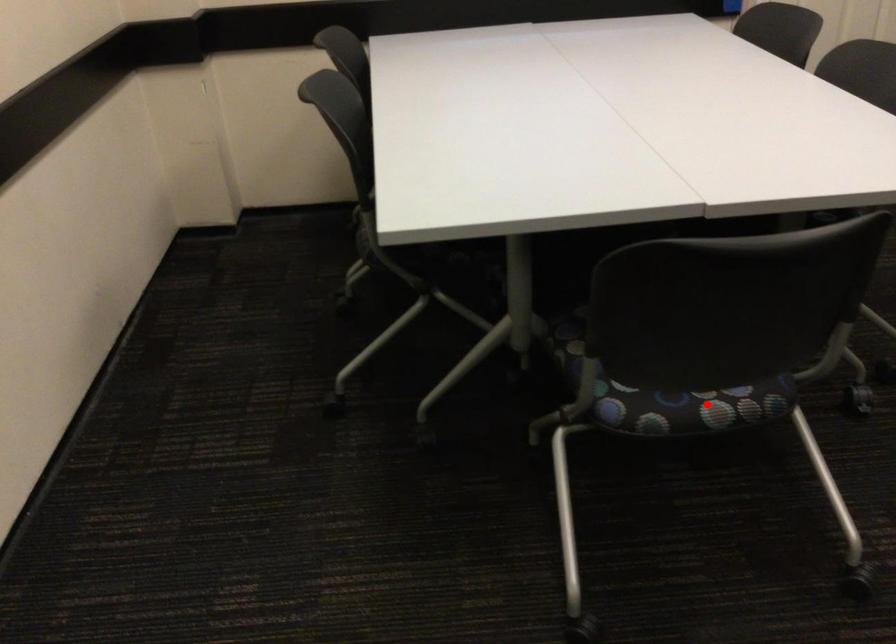
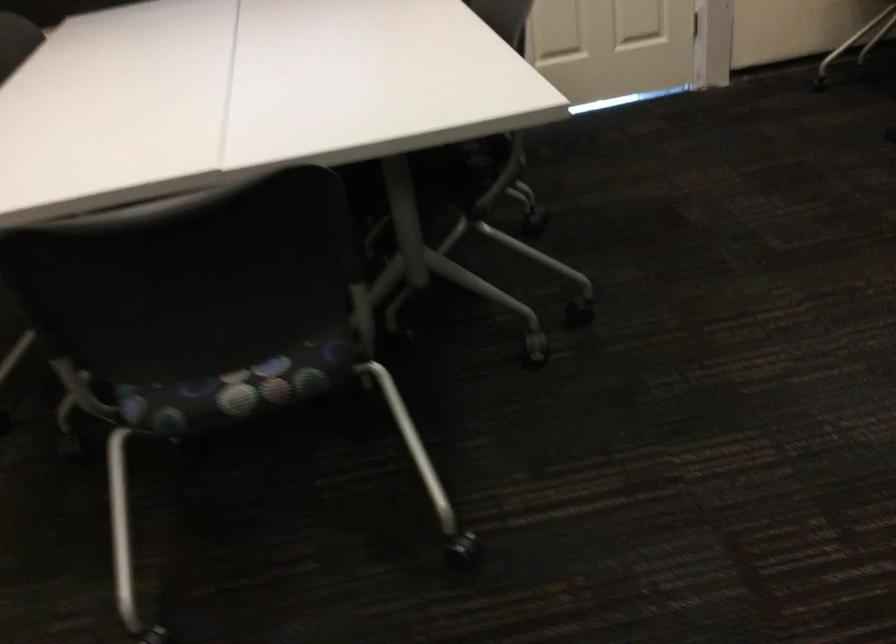
Find the pixel in the second image that matches the highlighted location in the first image.

(234, 389)